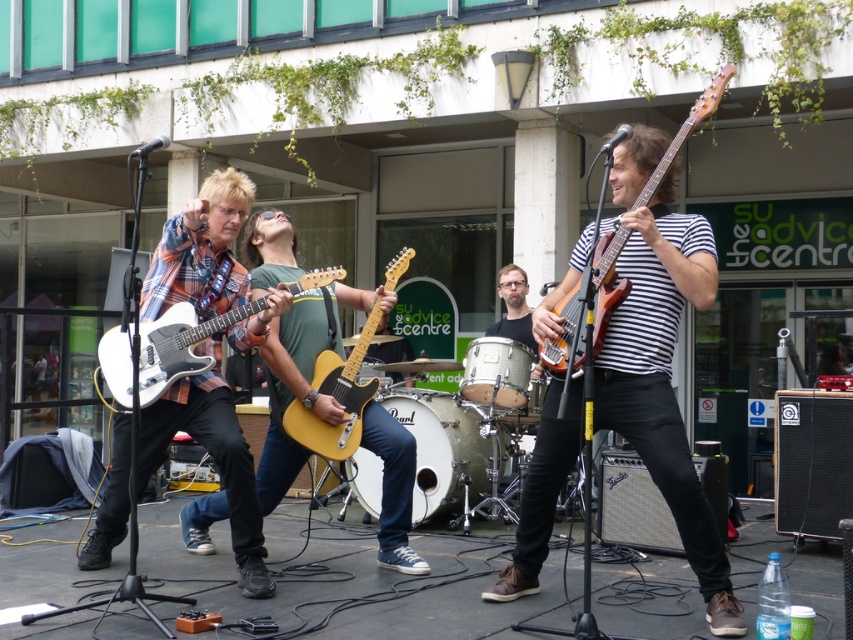
Question: Among these points, which one is nearest to the camera?

Choices:
 (A) (257, 308)
 (B) (258, 240)
 (C) (619, 428)

Answer: (C)

Question: Which of these objects is positioned closest to the matte brown electric guitar at right?

Choices:
 (A) plaid fabric shirt at left
 (B) butterscotch wood electric guitar at center

Answer: (B)

Question: Can you confirm if matte white guitar at center is smaller than plaid fabric shirt at left?

Choices:
 (A) no
 (B) yes

Answer: (A)

Question: Can you confirm if plaid fabric shirt at left is smaller than matte brown electric guitar at right?

Choices:
 (A) no
 (B) yes

Answer: (A)

Question: Which point is closer to the camera taking this photo?

Choices:
 (A) (263, 568)
 (B) (688, 556)

Answer: (B)

Question: Is matte brown electric guitar at right positioned behind butterscotch wood electric guitar at center?

Choices:
 (A) no
 (B) yes

Answer: (A)